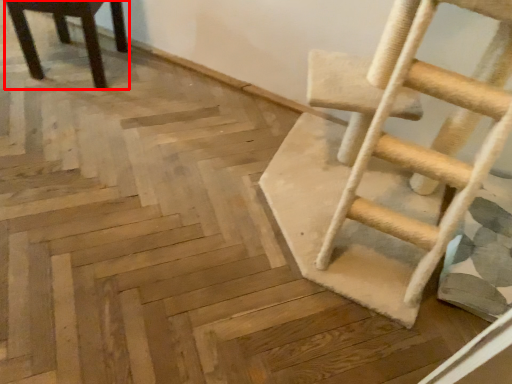
Question: From the image's perspective, where is chair (annotated by the red box) located in relation to ladder in the image?

Choices:
 (A) above
 (B) below

Answer: (A)